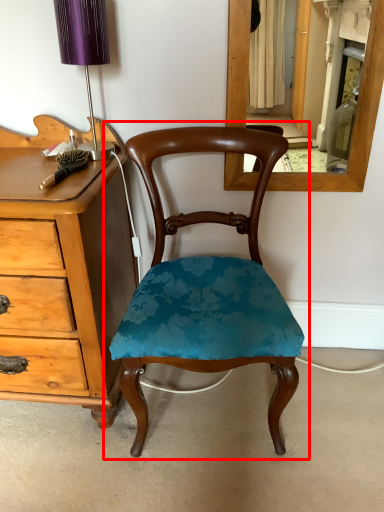
Question: Observing the image, what is the correct spatial positioning of chair (annotated by the red box) in reference to table lamp?

Choices:
 (A) right
 (B) left

Answer: (A)